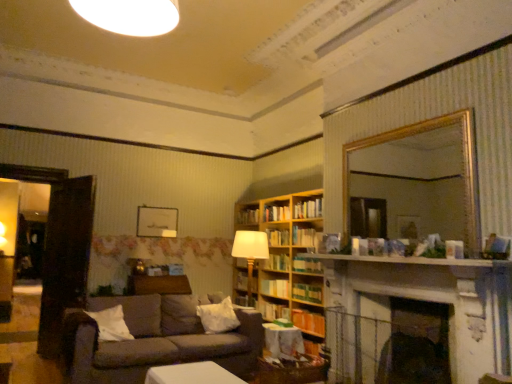
What do you see at coordinates (308, 209) in the screenshot?
I see `hardcover book at center, which is counted as the 11th book, starting from the bottom` at bounding box center [308, 209].

What do you see at coordinates (275, 288) in the screenshot?
I see `hardcover book at center, marked as the fourth book in a bottom-to-top arrangement` at bounding box center [275, 288].

Measure the distance between hardcover book at center, arranged as the 9th book when ordered from the bottom, and camera.

hardcover book at center, arranged as the 9th book when ordered from the bottom, and camera are 4.84 meters apart from each other.

The width and height of the screenshot is (512, 384). Describe the element at coordinates (303, 237) in the screenshot. I see `hardcover book at center, arranged as the 9th book when ordered from the bottom` at that location.

I want to click on white soft pillow at center, positioned as the 2th pillow in front-to-back order, so click(218, 317).

Are hardcover book at center, the third book when ordered from bottom to top, and wooden textured table at center making contact?

They are not placed beside each other.

Considering the relative positions of hardcover book at center, the third book when ordered from bottom to top, and wooden textured table at center in the image provided, is hardcover book at center, the third book when ordered from bottom to top, to the left or to the right of wooden textured table at center?

Based on their positions, hardcover book at center, the third book when ordered from bottom to top, is located to the left of wooden textured table at center.

There is a wooden textured table at center. Where is `the 3rd book above it (from the image's perspective)`? The height and width of the screenshot is (384, 512). the 3rd book above it (from the image's perspective) is located at coordinates (241, 281).

Based on the photo, how many degrees apart are the facing directions of hardcover book at center, the third book when ordered from bottom to top, and wooden textured table at center?

hardcover book at center, the third book when ordered from bottom to top, and wooden textured table at center are facing 87.9 degrees away from each other.

Is white wooden mantle at upper center not near hardcover book at center, arranged as the 3th book when viewed from the top?

Yes, white wooden mantle at upper center and hardcover book at center, arranged as the 3th book when viewed from the top, are located far from each other.

Where is `the 1st book above the white wooden mantle at upper center (from the image's perspective)`? The width and height of the screenshot is (512, 384). the 1st book above the white wooden mantle at upper center (from the image's perspective) is located at coordinates (303, 237).

Is point (490, 262) closer to viewer compared to point (305, 230)?

Yes, point (490, 262) is closer to viewer.

Is white wooden mantle at upper center bigger or smaller than hardcover book at center, arranged as the 9th book when ordered from the bottom?

Clearly, white wooden mantle at upper center is larger in size than hardcover book at center, arranged as the 9th book when ordered from the bottom.

In the image, there is a hardcover book at center, the eighth book positioned from the bottom. What are the coordinates of `table lamp below it (from a real-world perspective)` in the screenshot? It's located at (138, 265).

Which of these two, matte gold table lamp at center or hardcover book at center, the eighth book positioned from the bottom, is thinner?

hardcover book at center, the eighth book positioned from the bottom, is thinner.

From the picture: Who is taller, matte gold table lamp at center or hardcover book at center, arranged as the fourth book when viewed from the top?

With more height is matte gold table lamp at center.

Based on the photo, in terms of size, does matte gold table lamp at center appear bigger or smaller than hardcover book at center, the eighth book positioned from the bottom?

Considering their sizes, matte gold table lamp at center takes up more space than hardcover book at center, the eighth book positioned from the bottom.

Based on the photo, between white glossy light fixture at upper center and wooden bookcase at center, which one appears on the right side from the viewer's perspective?

wooden bookcase at center.

Based on the photo, who is taller, white glossy light fixture at upper center or wooden bookcase at center?

wooden bookcase at center.

What's the angular difference between white glossy light fixture at upper center and wooden bookcase at center's facing directions?

The angular difference between white glossy light fixture at upper center and wooden bookcase at center is 90.9 degrees.

Is white glossy light fixture at upper center looking in the opposite direction of wooden bookcase at center?

No, wooden bookcase at center is not at the back of white glossy light fixture at upper center.

Between white soft pillow at center, which appears as the 2th pillow when viewed from the left, and wooden bookshelf at center, which is counted as the tenth book, starting from the bottom, which one has larger size?

white soft pillow at center, which appears as the 2th pillow when viewed from the left.

From their relative heights in the image, would you say white soft pillow at center, which appears as the 2th pillow when viewed from the left, is taller or shorter than wooden bookshelf at center, arranged as the second book when viewed from the top?

white soft pillow at center, which appears as the 2th pillow when viewed from the left, is taller than wooden bookshelf at center, arranged as the second book when viewed from the top.

Where is `the 1st book to the right of the white soft pillow at center, positioned as the first pillow in back-to-front order, counting from the anchor's position`? This screenshot has width=512, height=384. the 1st book to the right of the white soft pillow at center, positioned as the first pillow in back-to-front order, counting from the anchor's position is located at coordinates (248, 217).

Is point (229, 300) closer or farther from the camera than point (241, 214)?

Point (229, 300) is closer to the camera than point (241, 214).

Which book is the 3rd one when counting from the left side of the hardcover book at center, which ranks as the 7th book in top-to-bottom order? Please provide its 2D coordinates.

[(308, 321)]

Is there a large distance between hardcover book at center, which ranks as the 7th book in top-to-bottom order, and orange matte bookshelf at center, the tenth book in the top-to-bottom sequence?

No, there isn't a large distance between hardcover book at center, which ranks as the 7th book in top-to-bottom order, and orange matte bookshelf at center, the tenth book in the top-to-bottom sequence.

From the image's perspective, which one is positioned higher, hardcover book at center, placed as the fifth book when sorted from bottom to top, or orange matte bookshelf at center, the tenth book in the top-to-bottom sequence?

hardcover book at center, placed as the fifth book when sorted from bottom to top, appears higher in the image.

From a real-world perspective, between hardcover book at center, which ranks as the 7th book in top-to-bottom order, and orange matte bookshelf at center, marked as the second book in a bottom-to-top arrangement, who is vertically lower?

orange matte bookshelf at center, marked as the second book in a bottom-to-top arrangement, from a real-world perspective.

Measure the distance between wooden bookshelf at center, which is counted as the tenth book, starting from the bottom, and hardcover book at center, the 11th book in the top-to-bottom sequence.

wooden bookshelf at center, which is counted as the tenth book, starting from the bottom, and hardcover book at center, the 11th book in the top-to-bottom sequence, are 4.19 feet apart.

Is point (257, 213) in front of point (267, 318)?

No.

Does wooden bookshelf at center, which is counted as the tenth book, starting from the bottom, have a larger size compared to hardcover book at center, the 11th book in the top-to-bottom sequence?

Actually, wooden bookshelf at center, which is counted as the tenth book, starting from the bottom, might be smaller than hardcover book at center, the 11th book in the top-to-bottom sequence.

Is wooden bookshelf at center, which is counted as the tenth book, starting from the bottom, facing towards hardcover book at center, the 11th book in the top-to-bottom sequence?

No, wooden bookshelf at center, which is counted as the tenth book, starting from the bottom, does not turn towards hardcover book at center, the 11th book in the top-to-bottom sequence.

The width and height of the screenshot is (512, 384). In order to click on table below the hardcover book at center, the third book when ordered from bottom to top (from a real-world perspective) in this screenshot , I will do `click(283, 341)`.

I want to click on book that is the 4th one when counting backward from the white wooden mantle at upper center, so click(x=303, y=237).

Considering their positions, is green matte bookshelf at center, which is counted as the 5th book, starting from the top, positioned closer to white soft pillow at lower left, the 1th pillow viewed from the left, than white glossy light fixture at upper center?

green matte bookshelf at center, which is counted as the 5th book, starting from the top, lies closer to white soft pillow at lower left, the 1th pillow viewed from the left, than the other object.

Looking at the image, which one is located closer to hardcover book at center, the third book when ordered from bottom to top, wooden bookcase at center or matte gold table lamp at center?

Among the two, wooden bookcase at center is located nearer to hardcover book at center, the third book when ordered from bottom to top.

Based on their spatial positions, is white soft pillow at center, the 1th pillow in the right-to-left sequence, or hardcover book at center, placed as the fifth book when sorted from bottom to top, closer to hardcover book at center, the eighth book positioned from the bottom?

hardcover book at center, placed as the fifth book when sorted from bottom to top, is closer to hardcover book at center, the eighth book positioned from the bottom.

From the image, which object appears to be farther from white soft pillow at lower left, the second pillow viewed from the right, hardcover book at center, arranged as the 3th book when viewed from the top, or white soft pillow at center, which appears as the 2th pillow when viewed from the left?

hardcover book at center, arranged as the 3th book when viewed from the top, lies further to white soft pillow at lower left, the second pillow viewed from the right, than the other object.

Which object lies further to the anchor point hardcover book at center, which is counted as the 11th book, starting from the bottom, wooden bookcase at center or white glossy light fixture at upper center?

white glossy light fixture at upper center lies further to hardcover book at center, which is counted as the 11th book, starting from the bottom, than the other object.

Which object lies nearer to the anchor point hardcover book at center, which ranks as the 7th book in top-to-bottom order, white wooden mantle at upper center or hardcover book at center, arranged as the 9th book when ordered from the bottom?

The object closer to hardcover book at center, which ranks as the 7th book in top-to-bottom order, is hardcover book at center, arranged as the 9th book when ordered from the bottom.

Based on their spatial positions, is gold-framed mirror at upper right or green matte bookshelf at center, which is the seventh book from bottom to top, closer to hardcover book at center, placed as the fifth book when sorted from bottom to top?

green matte bookshelf at center, which is the seventh book from bottom to top, lies closer to hardcover book at center, placed as the fifth book when sorted from bottom to top, than the other object.

Which object lies further to the anchor point white soft pillow at lower left, the second pillow viewed from the right, hardcover book at center, marked as the fourth book in a bottom-to-top arrangement, or green matte bookshelf at center, which is the seventh book from bottom to top?

green matte bookshelf at center, which is the seventh book from bottom to top.

The height and width of the screenshot is (384, 512). I want to click on studio couch between white wooden mantle at upper center and hardcover book at center, which ranks as the 7th book in top-to-bottom order, in the front-back direction, so click(x=155, y=340).

The width and height of the screenshot is (512, 384). In order to click on pillow located between wooden picture frame at center and orange matte bookshelf at center, marked as the second book in a bottom-to-top arrangement, in the left-right direction in this screenshot , I will do `click(218, 317)`.

Locate an element on the screen. studio couch between white glossy light fixture at upper center and matte gold table lamp at center in the front-back direction is located at coordinates click(155, 340).

Identify the location of bookcase between black matte fireplace at lower center and hardcover book at center, placed as the fifth book when sorted from bottom to top, from front to back. The width and height of the screenshot is (512, 384). (290, 262).